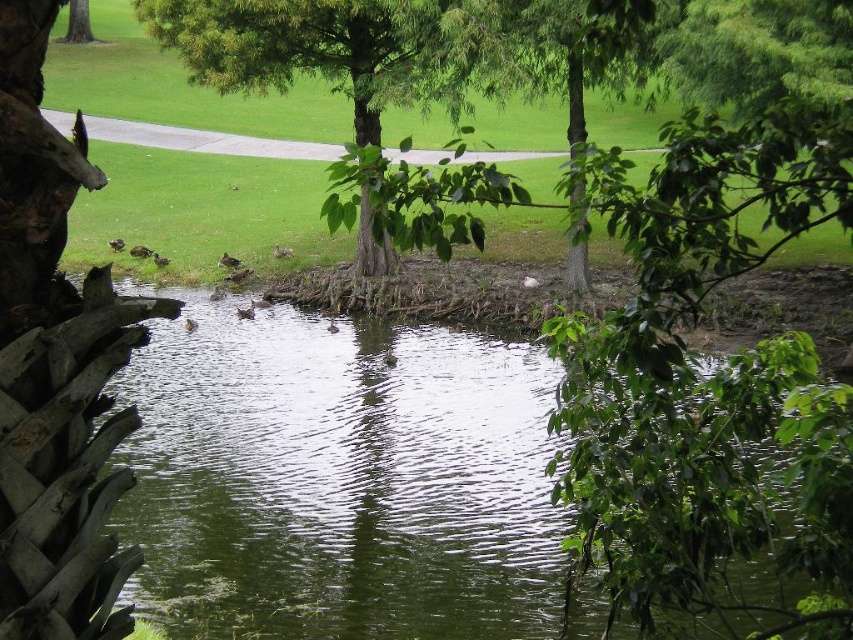
Question: Is green liquid water at center closer to camera compared to green leafy tree at upper left?

Choices:
 (A) yes
 (B) no

Answer: (A)

Question: Which is nearer to the green leafy tree trunk at center?

Choices:
 (A) green leafy tree at upper left
 (B) green liquid water at center

Answer: (B)

Question: Among these objects, which one is farthest from the camera?

Choices:
 (A) green leafy tree at center
 (B) green leafy tree at upper left

Answer: (B)

Question: Is green liquid water at center thinner than green leafy tree at center?

Choices:
 (A) yes
 (B) no

Answer: (B)

Question: Among these objects, which one is nearest to the camera?

Choices:
 (A) green leafy tree trunk at center
 (B) green liquid water at center

Answer: (A)

Question: Can you confirm if green leafy tree at center is wider than green leafy tree at upper left?

Choices:
 (A) no
 (B) yes

Answer: (B)